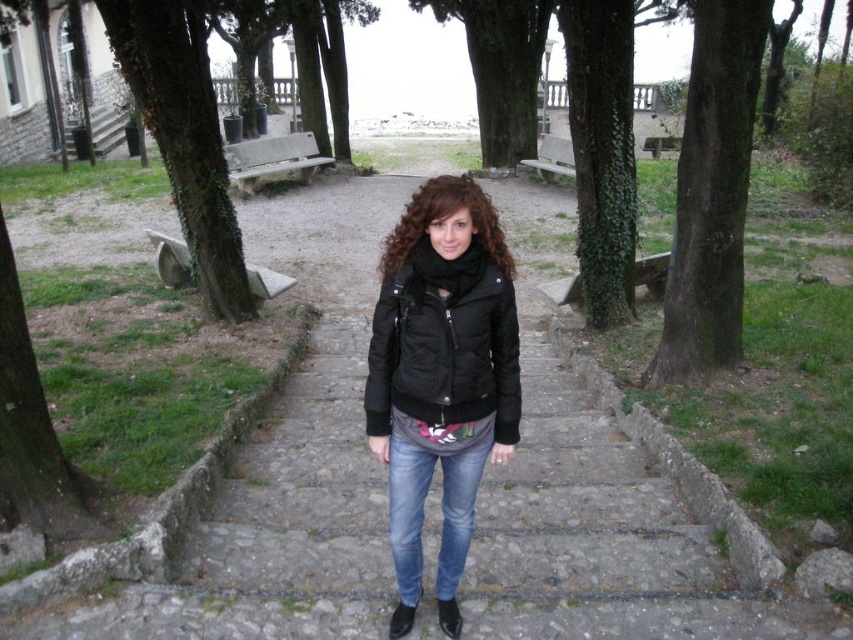
Who is positioned more to the left, green rough bark tree at center or green ivy-covered tree at center-right?

green ivy-covered tree at center-right is more to the left.

Between green rough bark tree at center and green ivy-covered tree at center-right, which one has more height?

green rough bark tree at center is taller.

Describe the element at coordinates (711, 193) in the screenshot. I see `green rough bark tree at center` at that location.

This screenshot has width=853, height=640. In order to click on green rough bark tree at center in this screenshot , I will do `click(711, 193)`.

Does green rough bark tree at left have a greater width compared to green rough bark tree at upper center?

Yes, green rough bark tree at left is wider than green rough bark tree at upper center.

Which is below, green rough bark tree at left or green rough bark tree at upper center?

green rough bark tree at left

Is point (239, 250) closer to camera compared to point (489, 4)?

Yes, point (239, 250) is closer to viewer.

In order to click on green rough bark tree at left in this screenshot , I will do `click(184, 138)`.

Can you confirm if black quilted jacket at center is taller than green rough bark tree at left?

Incorrect, black quilted jacket at center's height is not larger of green rough bark tree at left's.

Which of these two, black quilted jacket at center or green rough bark tree at left, stands taller?

green rough bark tree at left

Identify the location of black quilted jacket at center. (444, 344).

Locate an element on the screen. black quilted jacket at center is located at coordinates (444, 344).